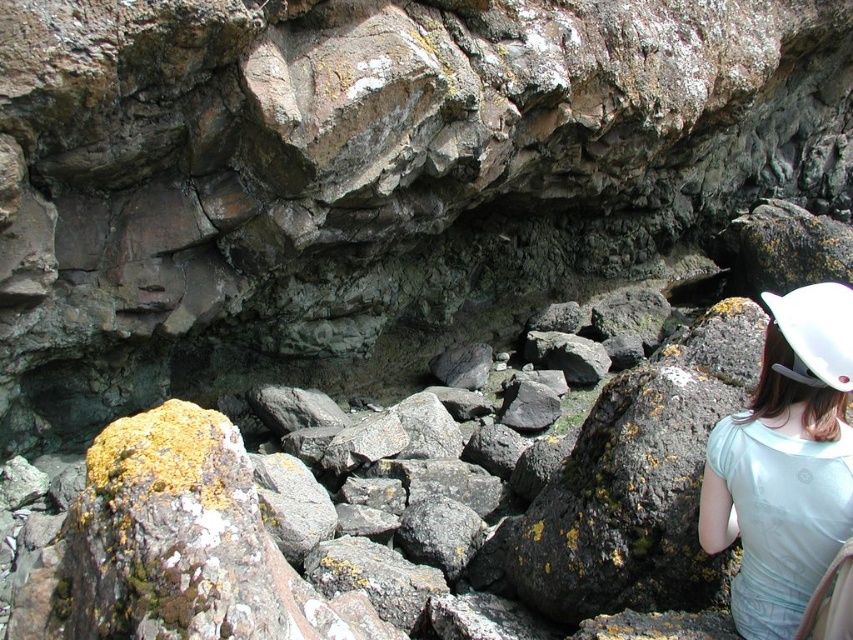
Can you confirm if white hard hat at center right is shorter than white matte hard hat at right?

In fact, white hard hat at center right may be taller than white matte hard hat at right.

Is point (755, 467) closer to viewer compared to point (801, 308)?

No, (755, 467) is further to viewer.

The height and width of the screenshot is (640, 853). What are the coordinates of `white hard hat at center right` in the screenshot? It's located at (785, 464).